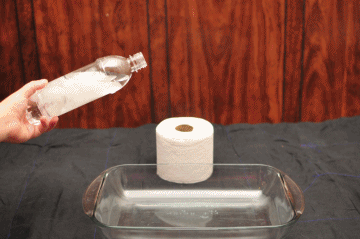
Identify the location of blanket. Image resolution: width=360 pixels, height=239 pixels. (303, 141).